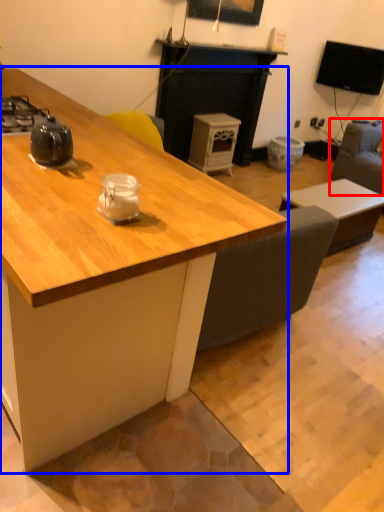
Question: Which of the following is the farthest to the observer, swivel chair (highlighted by a red box) or desk (highlighted by a blue box)?

Choices:
 (A) swivel chair
 (B) desk

Answer: (A)